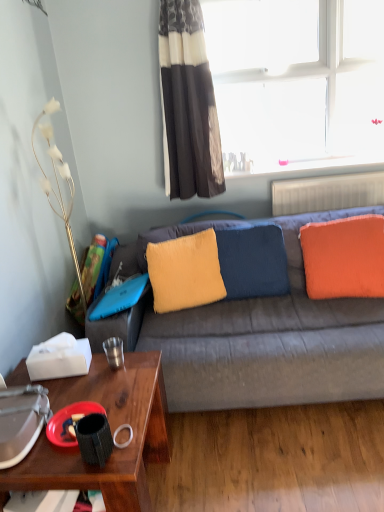
The image size is (384, 512). I want to click on free point behind black textured coffee cup at lower left, the first coffee cup in the bottom-to-top sequence, so click(x=120, y=406).